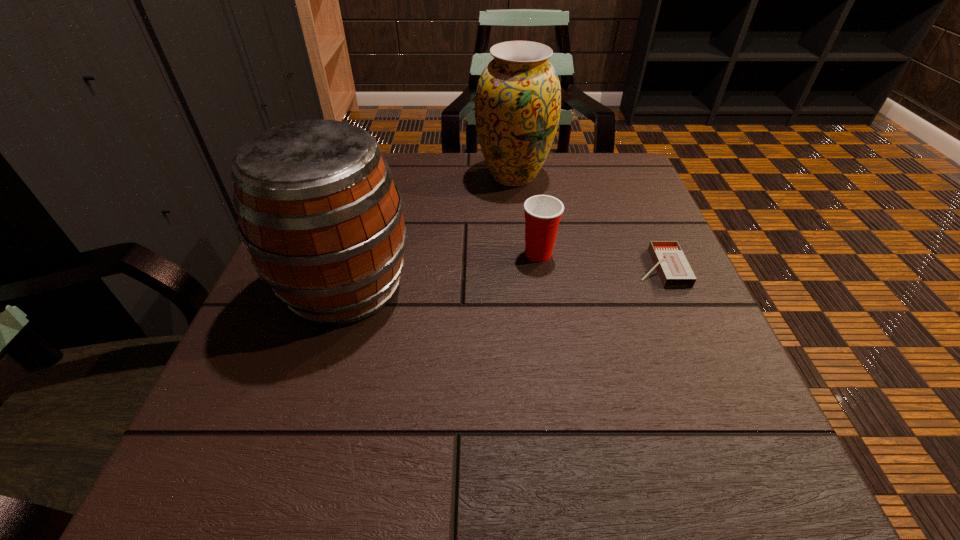
This screenshot has width=960, height=540. In order to click on free point between the leftmost object and the second shortest object in this screenshot , I will do `click(442, 270)`.

You are a GUI agent. You are given a task and a screenshot of the screen. Output one action in this format:
    pyautogui.click(x=<x>, y=<y>)
    Task: Click on the free area in between the leftmost object and the matchbox
    This screenshot has width=960, height=540.
    Given the screenshot: What is the action you would take?
    tap(502, 277)

Locate an element on the screen. vacant area between the matchbox and the vase is located at coordinates (587, 222).

Find the location of a particular element. The height and width of the screenshot is (540, 960). free space between the matchbox and the farthest object is located at coordinates (587, 222).

The image size is (960, 540). What are the coordinates of `vacant point located between the shortest object and the vase` in the screenshot? It's located at (587, 222).

At what (x,y) coordinates should I click in order to perform the action: click on empty location between the second shortest object and the rightmost object. Please return your answer as a coordinate pair (x, y). This screenshot has height=540, width=960. Looking at the image, I should click on (599, 261).

You are a GUI agent. You are given a task and a screenshot of the screen. Output one action in this format:
    pyautogui.click(x=<x>, y=<y>)
    Task: Click on the vacant area that lies between the Dixie cup and the cider
    
    Given the screenshot: What is the action you would take?
    pyautogui.click(x=442, y=270)

The image size is (960, 540). I want to click on vacant point located between the rightmost object and the leftmost object, so click(502, 277).

What are the coordinates of `object identified as the second closest to the Dixie cup` in the screenshot? It's located at (518, 99).

Point out which object is positioned as the nearest to the rightmost object. Please provide its 2D coordinates. Your answer should be formatted as a tuple, i.e. [(x, y)], where the tuple contains the x and y coordinates of a point satisfying the conditions above.

[(543, 213)]